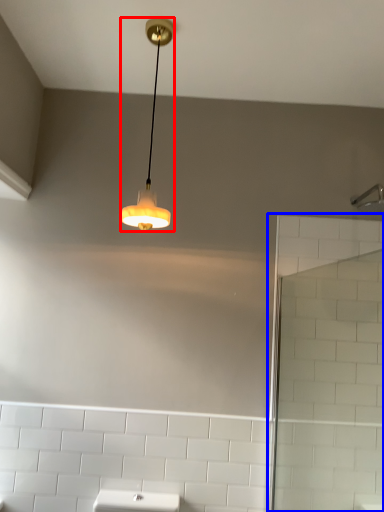
Question: Which of the following is the closest to the observer, lamp (highlighted by a red box) or screen door (highlighted by a blue box)?

Choices:
 (A) lamp
 (B) screen door

Answer: (B)